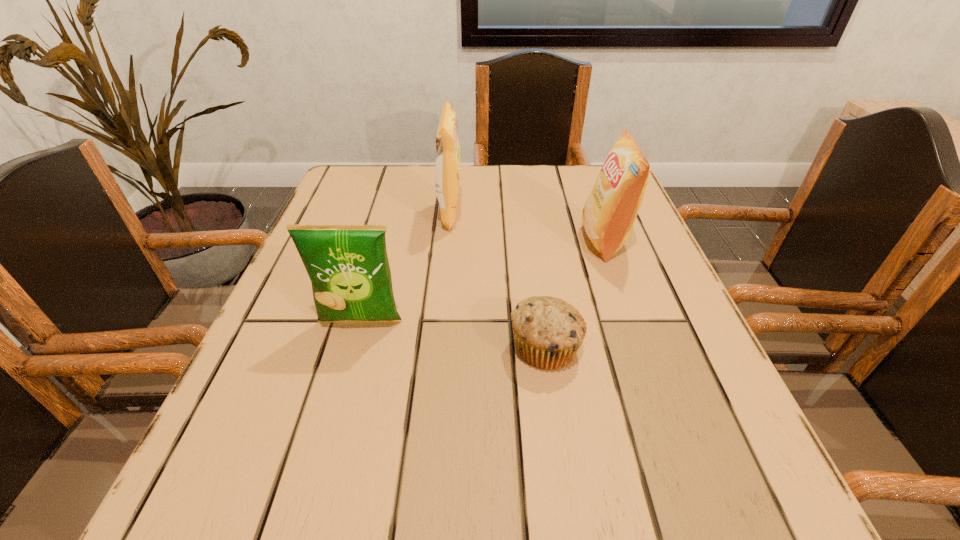
Where is `vacant space that satisfies the following two spatial constraints: 1. on the front of the second object from left to right with the logo; 2. on the right side of the second object from right to left`? vacant space that satisfies the following two spatial constraints: 1. on the front of the second object from left to right with the logo; 2. on the right side of the second object from right to left is located at coordinates (438, 347).

Where is `blank area in the image that satisfies the following two spatial constraints: 1. on the front of the second object from right to left with the logo; 2. on the right side of the second crisp (potato chip) from right to left`? The image size is (960, 540). blank area in the image that satisfies the following two spatial constraints: 1. on the front of the second object from right to left with the logo; 2. on the right side of the second crisp (potato chip) from right to left is located at coordinates point(438,347).